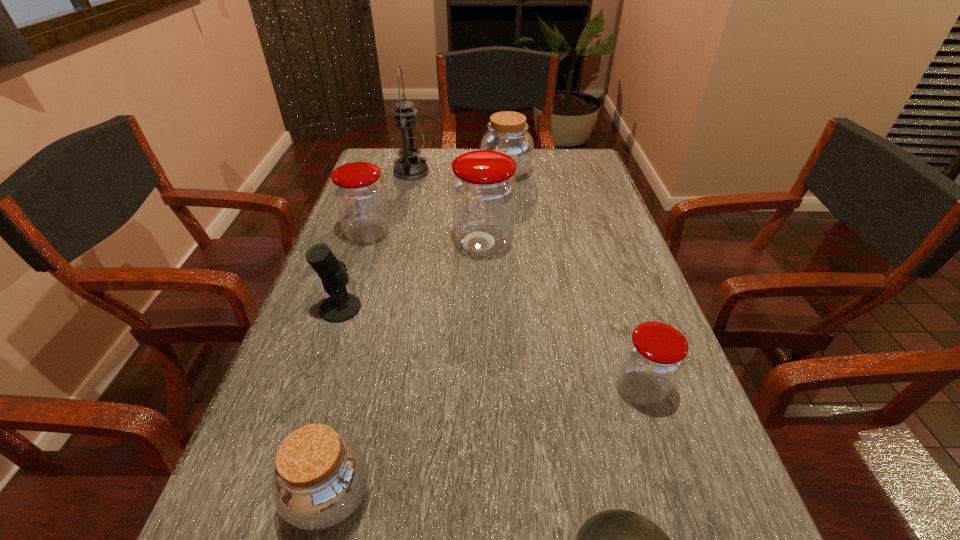
Where is `microphone located in the left edge section of the desktop`? This screenshot has height=540, width=960. microphone located in the left edge section of the desktop is located at coordinates (341, 306).

Locate an element on the screen. The height and width of the screenshot is (540, 960). object that is at the right edge is located at coordinates (654, 357).

You are a GUI agent. You are given a task and a screenshot of the screen. Output one action in this format:
    pyautogui.click(x=<x>, y=<y>)
    Task: Click on the object that is at the far left corner
    This screenshot has height=540, width=960.
    Given the screenshot: What is the action you would take?
    pyautogui.click(x=407, y=138)

Locate an element on the screen. The height and width of the screenshot is (540, 960). free point at the left edge is located at coordinates (377, 327).

The width and height of the screenshot is (960, 540). Find the location of `vacant space at the right edge of the desktop`. vacant space at the right edge of the desktop is located at coordinates (598, 380).

The height and width of the screenshot is (540, 960). Identify the location of vacant space at the far right corner. (564, 161).

At what (x,y) coordinates should I click in order to perform the action: click on vacant space that is in between the smallest red jar and the microphone. Please return your answer as a coordinate pair (x, y). Image resolution: width=960 pixels, height=540 pixels. Looking at the image, I should click on (491, 349).

Where is `free space between the rightmost jar and the second biggest red jar`? This screenshot has height=540, width=960. free space between the rightmost jar and the second biggest red jar is located at coordinates (504, 312).

Image resolution: width=960 pixels, height=540 pixels. What are the coordinates of `vacant space in between the fourth farthest jar and the leftmost red jar` in the screenshot? It's located at (504, 312).

What are the coordinates of `object that ranks as the third closest to the biggest red jar` in the screenshot? It's located at (341, 306).